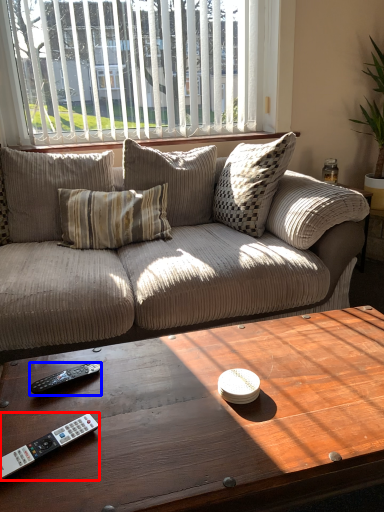
Question: Which point is further to the camera, remote control (highlighted by a red box) or remote control (highlighted by a blue box)?

Choices:
 (A) remote control
 (B) remote control

Answer: (B)